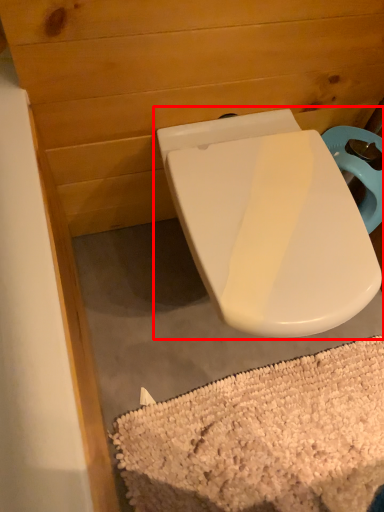
Question: Where is toilet (annotated by the red box) located in relation to bath mat in the image?

Choices:
 (A) right
 (B) left

Answer: (B)